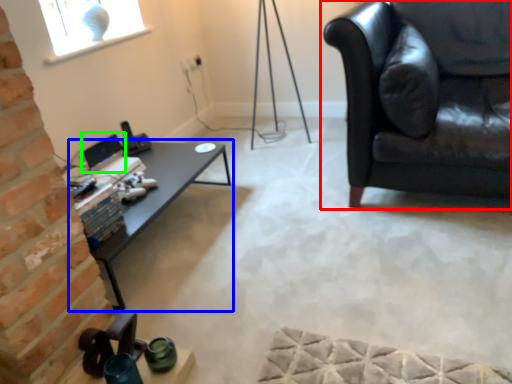
Question: Considering the real-world distances, which object is closest to studio couch (highlighted by a red box)? table (highlighted by a blue box) or computer monitor (highlighted by a green box).

Choices:
 (A) table
 (B) computer monitor

Answer: (A)